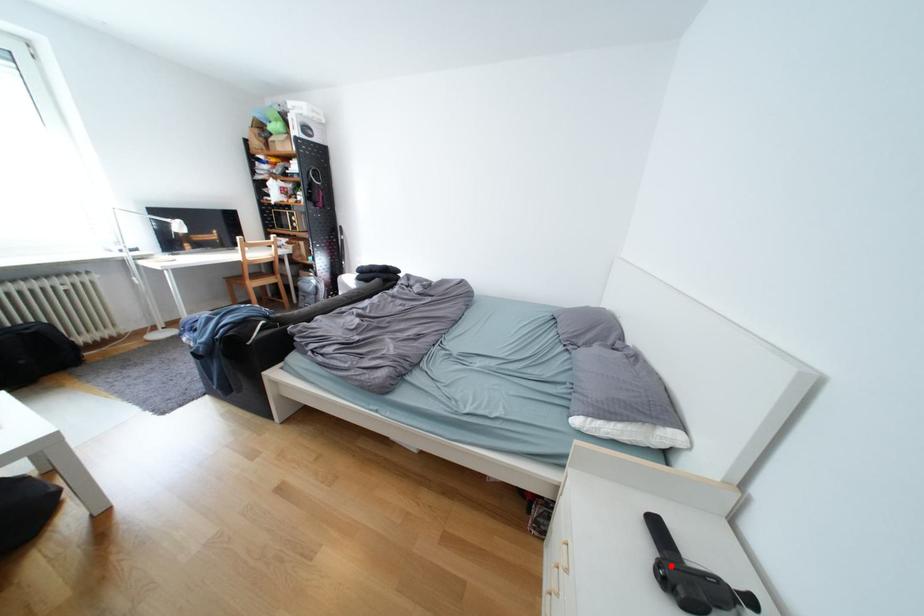
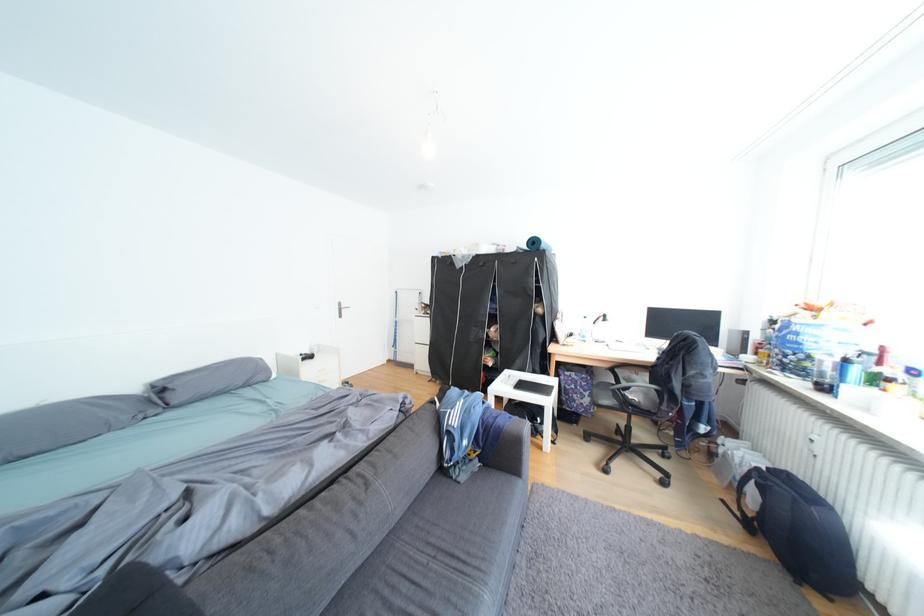
Question: I am providing you with two images of the same scene from different viewpoints. A red point is marked on the first image. At the location where the point appears in image 1, is it still visible in image 2?

Choices:
 (A) Yes
 (B) No

Answer: (B)